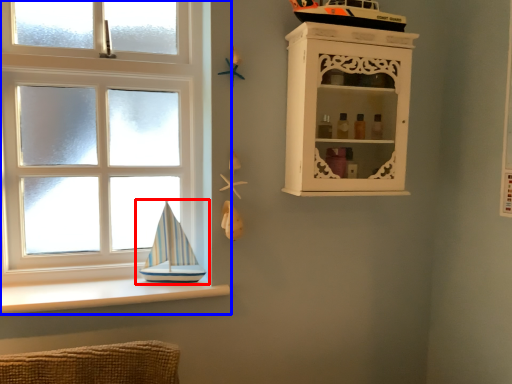
Question: Which of the following is the closest to the observer, boat (highlighted by a red box) or window (highlighted by a blue box)?

Choices:
 (A) boat
 (B) window

Answer: (B)